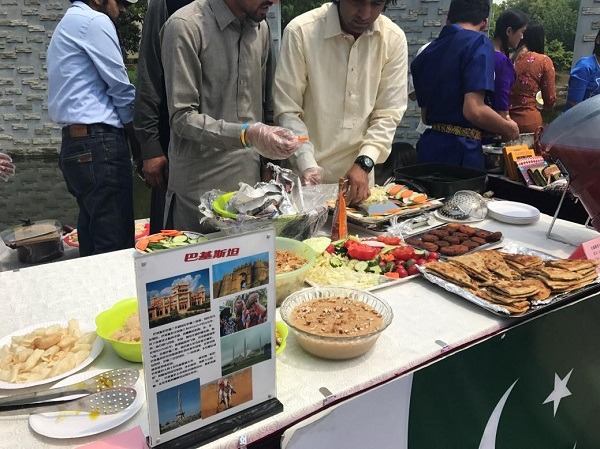
Locate an element on the screen. flag poster is located at coordinates (475, 364).